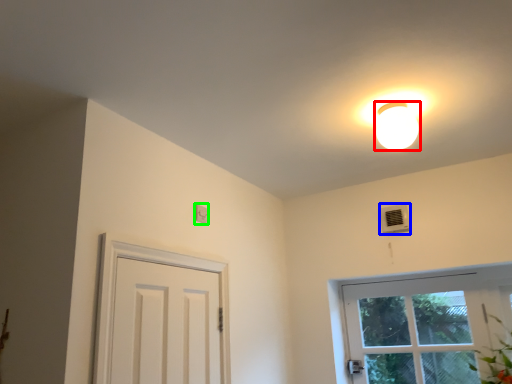
Question: Estimate the real-world distances between objects in this image. Which object is farther from lamp (highlighted by a red box), air conditioner (highlighted by a blue box) or light switch (highlighted by a green box)?

Choices:
 (A) air conditioner
 (B) light switch

Answer: (B)